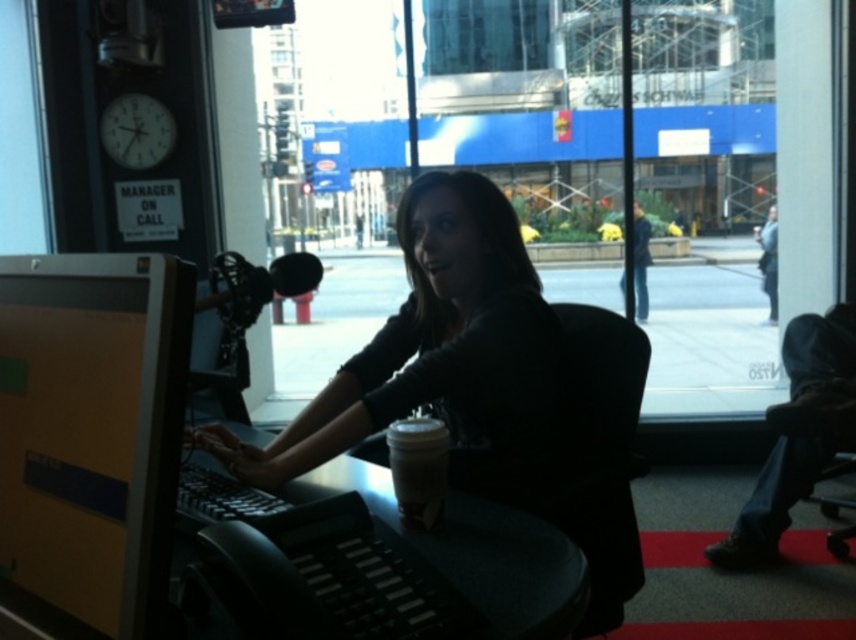
Question: Which of these objects is positioned farthest from the matte black shirt at center?

Choices:
 (A) dark blue jeans at center
 (B) white paper cup at center
 (C) black plastic table at center
 (D) matte yellow monitor at center-left

Answer: (A)

Question: Which of the following is the farthest from the observer?

Choices:
 (A) white paper cup at center
 (B) matte black shirt at center

Answer: (B)

Question: Among these points, which one is nearest to the camera?

Choices:
 (A) (25, 532)
 (B) (428, 500)
 (C) (645, 237)
 (D) (477, 560)

Answer: (A)

Question: In this image, where is white paper cup at center located relative to dark blue jeans at center?

Choices:
 (A) above
 (B) below

Answer: (B)

Question: Is matte yellow monitor at center-left wider than white paper cup at center?

Choices:
 (A) no
 (B) yes

Answer: (B)

Question: Does matte yellow monitor at center-left appear under white paper cup at center?

Choices:
 (A) no
 (B) yes

Answer: (A)